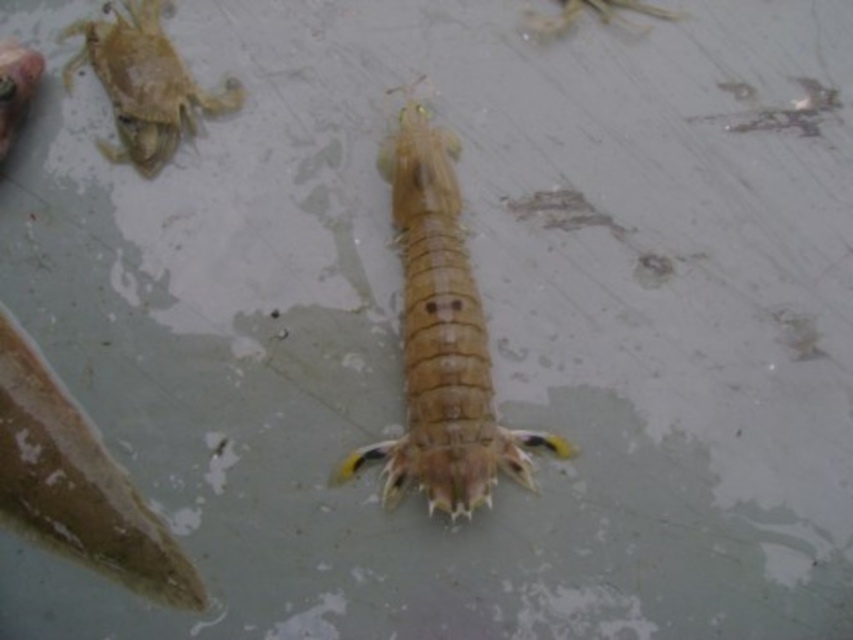
Question: Is the position of translucent yellowish crustacean at center more distant than that of translucent yellow crab at upper left?

Choices:
 (A) yes
 (B) no

Answer: (B)

Question: Which point is farther to the camera?

Choices:
 (A) (426, 492)
 (B) (148, 45)

Answer: (B)

Question: In this image, where is translucent yellowish crustacean at center located relative to translucent yellow crab at upper left?

Choices:
 (A) right
 (B) left

Answer: (A)

Question: Which of the following is the farthest from the observer?

Choices:
 (A) translucent yellowish crustacean at center
 (B) translucent yellow crab at upper left

Answer: (B)

Question: Can you confirm if translucent yellowish crustacean at center is positioned below translucent yellow crab at upper left?

Choices:
 (A) no
 (B) yes

Answer: (B)